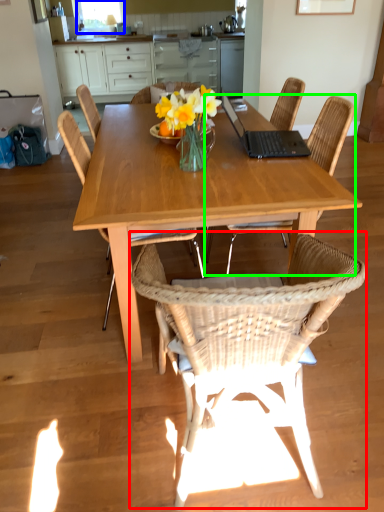
Question: Which is farther away from chair (highlighted by a red box)? window screen (highlighted by a blue box) or chair (highlighted by a green box)?

Choices:
 (A) window screen
 (B) chair

Answer: (A)